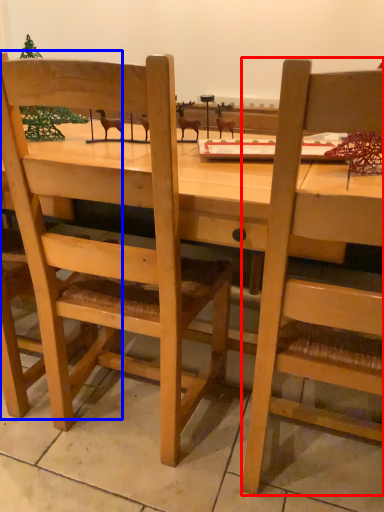
Question: Which object is closer to the camera taking this photo, chair (highlighted by a red box) or chair (highlighted by a blue box)?

Choices:
 (A) chair
 (B) chair

Answer: (A)